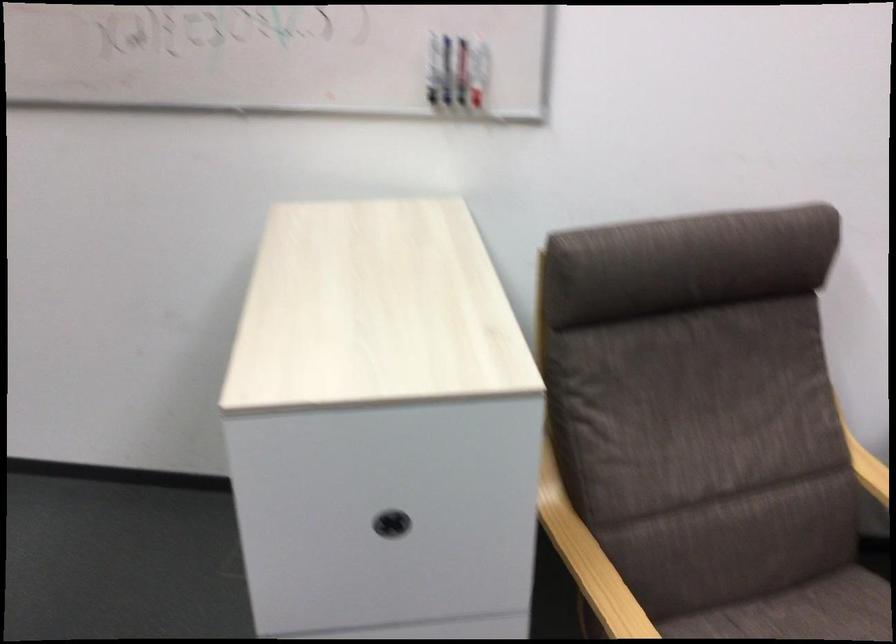
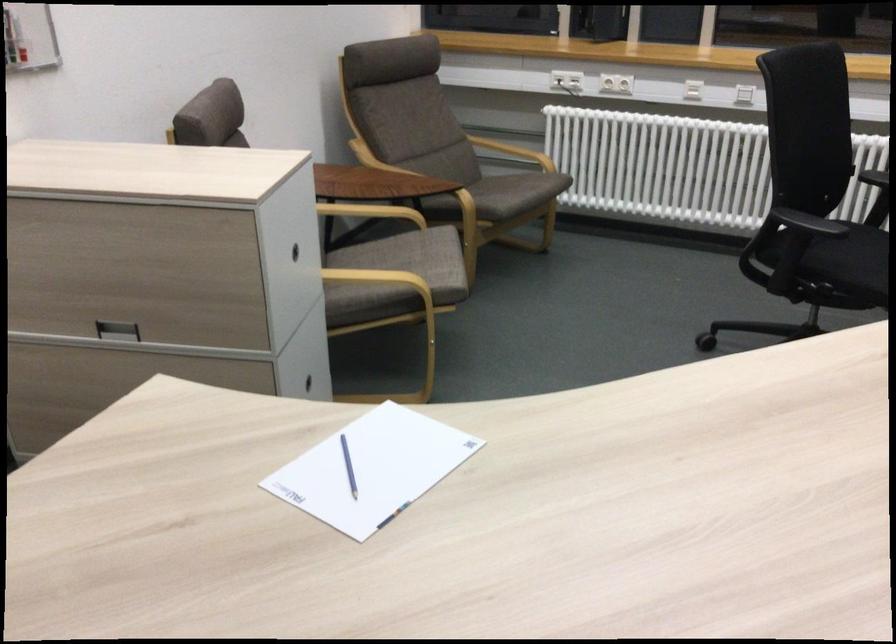
Question: I am providing you with two images of the same scene from different viewpoints. Which of the following objects are not visible in image2?

Choices:
 (A) white power outlet
 (B) recessed drawer handle
 (C) orange travel mug
 (D) chair armrest

Answer: (D)